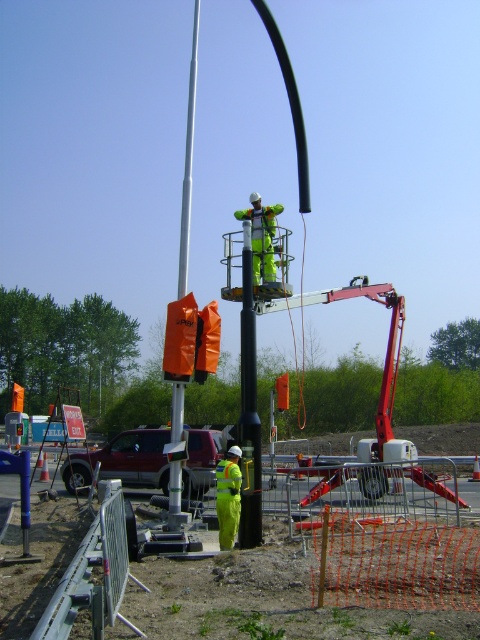
Describe the element at coordinates (249, 408) in the screenshot. This screenshot has width=480, height=640. I see `black rubber pole at center` at that location.

Does black rubber pole at center have a lesser width compared to white glossy pole at center?

Correct, black rubber pole at center's width is less than white glossy pole at center's.

Identify the location of black rubber pole at center. (249, 408).

You are a GUI agent. You are given a task and a screenshot of the screen. Output one action in this format:
    pyautogui.click(x=<x>, y=<y>)
    Task: Click on the black rubber pole at center
    
    Given the screenshot: What is the action you would take?
    pyautogui.click(x=249, y=408)

Is white glossy pole at center above high visibility yellow reflective suit at center?

Indeed, white glossy pole at center is positioned over high visibility yellow reflective suit at center.

Does point (188, 218) come in front of point (223, 500)?

That is False.

This screenshot has width=480, height=640. Find the location of `white glossy pole at center`. white glossy pole at center is located at coordinates (188, 164).

Which is in front, point (249, 426) or point (261, 241)?

Point (249, 426) is more forward.

The image size is (480, 640). What do you see at coordinates (249, 408) in the screenshot?
I see `black rubber pole at center` at bounding box center [249, 408].

Is point (256, 451) closer to viewer compared to point (261, 202)?

Yes, point (256, 451) is closer to viewer.

I want to click on black rubber pole at center, so click(249, 408).